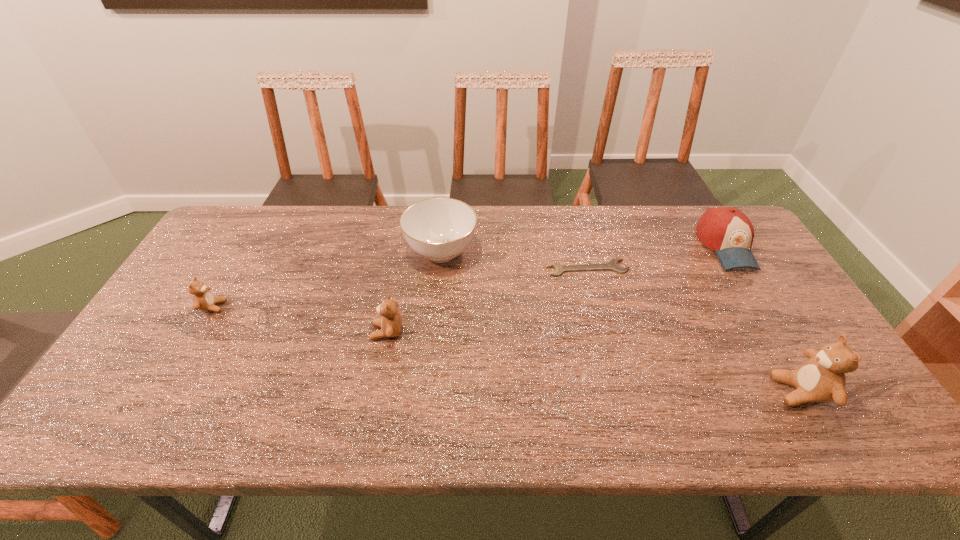
To ensure equal spacing by inserting another teddy_bear among them, please point out a vacant spot for this new teddy_bear. Please provide its 2D coordinates. Your answer should be formatted as a tuple, i.e. [(x, y)], where the tuple contains the x and y coordinates of a point satisfying the conditions above.

[(581, 360)]